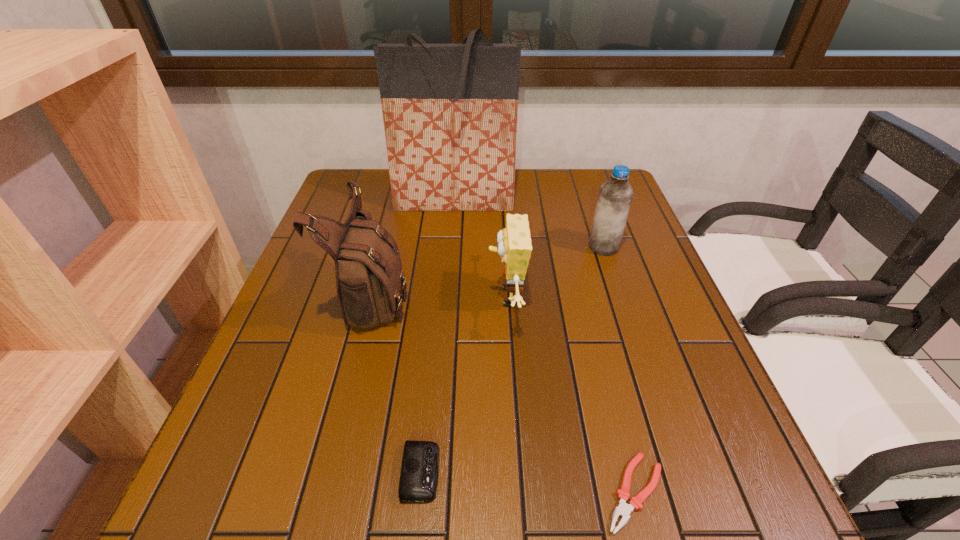
Identify the location of pliers that is at the right edge. Image resolution: width=960 pixels, height=540 pixels. (623, 509).

You are a GUI agent. You are given a task and a screenshot of the screen. Output one action in this format:
    pyautogui.click(x=<x>, y=<y>)
    Task: Click on the object that is at the near right corner
    The width and height of the screenshot is (960, 540).
    Given the screenshot: What is the action you would take?
    pyautogui.click(x=623, y=509)

At what (x,y) coordinates should I click in order to perform the action: click on free space at the left edge of the desktop. Please return your answer as a coordinate pair (x, y). Looking at the image, I should click on (287, 336).

Locate an element on the screen. free region at the right edge of the desktop is located at coordinates (667, 292).

Locate an element on the screen. The height and width of the screenshot is (540, 960). free space at the far left corner is located at coordinates (374, 172).

Locate an element on the screen. free space at the far right corner of the desktop is located at coordinates (572, 174).

Locate an element on the screen. This screenshot has width=960, height=540. empty location between the second tallest object and the pliers is located at coordinates (505, 394).

You are a GUI agent. You are given a task and a screenshot of the screen. Output one action in this format:
    pyautogui.click(x=<x>, y=<y>)
    Task: Click on the free point between the second tallest object and the pliers
    The width and height of the screenshot is (960, 540).
    Given the screenshot: What is the action you would take?
    pyautogui.click(x=505, y=394)

At what (x,y) coordinates should I click in order to perform the action: click on free space between the pliers and the alarm clock. Please return your answer as a coordinate pair (x, y). Looking at the image, I should click on click(x=528, y=482).

The image size is (960, 540). I want to click on vacant area between the tallest object and the shoulder bag, so click(415, 248).